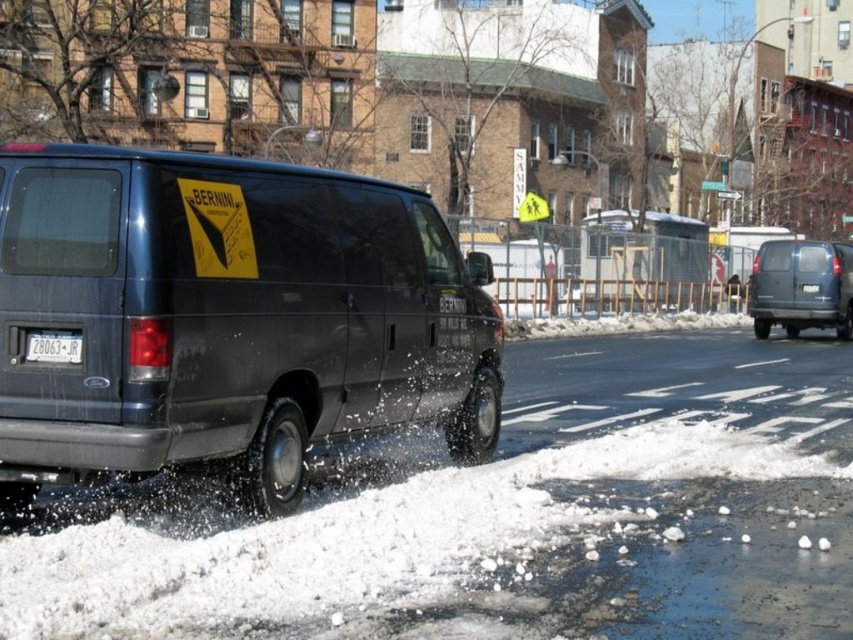
Is matte gray minivan at right closer to camera compared to white plastic license plate at lower left?

No, matte gray minivan at right is behind white plastic license plate at lower left.

Is point (776, 292) less distant than point (79, 337)?

No, it is not.

Image resolution: width=853 pixels, height=640 pixels. I want to click on matte gray minivan at right, so click(801, 285).

Is matte black van at left shorter than white plastic license plate at lower left?

Incorrect, matte black van at left's height does not fall short of white plastic license plate at lower left's.

Who is higher up, matte black van at left or white plastic license plate at lower left?

Positioned higher is matte black van at left.

Which is in front, point (39, 192) or point (27, 346)?

Point (27, 346) is more forward.

Image resolution: width=853 pixels, height=640 pixels. I want to click on matte black van at left, so click(x=228, y=317).

Who is lower down, matte black van at left or matte gray minivan at right?

matte black van at left is below.

Is point (276, 234) less distant than point (833, 260)?

That is True.

Measure the distance between point (132, 289) and camera.

Point (132, 289) and camera are 5.04 meters apart.

What are the coordinates of `matte black van at left` in the screenshot? It's located at (228, 317).